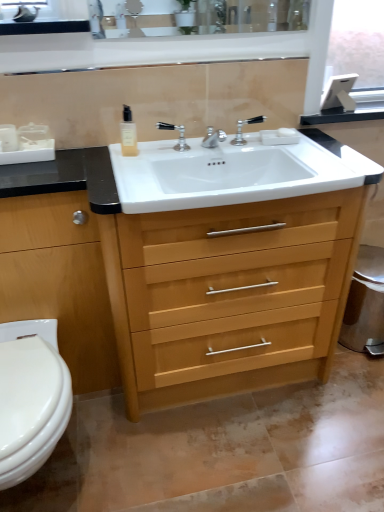
The image size is (384, 512). Identify the location of vacant area situated below white glossy toilet at lower left (from a real-world perspective). (51, 476).